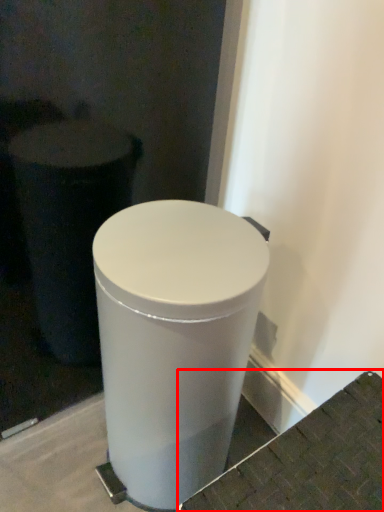
Question: From the image's perspective, where is concrete (annotated by the red box) located relative to waste container?

Choices:
 (A) below
 (B) above

Answer: (A)